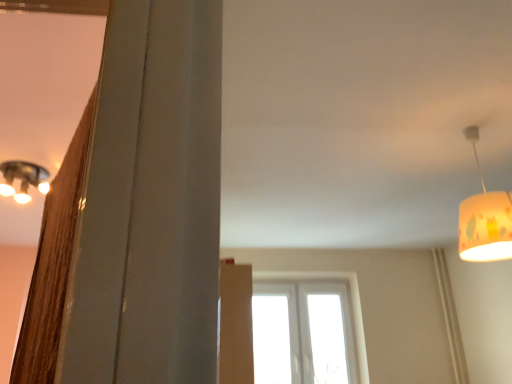
Question: Is transparent glass window at center in front of or behind yellow fabric lampshade at upper right in the image?

Choices:
 (A) front
 (B) behind

Answer: (B)

Question: From the image's perspective, is transparent glass window at center positioned above or below yellow fabric lampshade at upper right?

Choices:
 (A) above
 (B) below

Answer: (B)

Question: Does point (354, 337) appear closer or farther from the camera than point (509, 205)?

Choices:
 (A) closer
 (B) farther

Answer: (B)

Question: From the image's perspective, is yellow fabric lampshade at upper right above or below transparent glass window at center?

Choices:
 (A) below
 (B) above

Answer: (B)

Question: Is yellow fabric lampshade at upper right wider or thinner than transparent glass window at center?

Choices:
 (A) thin
 (B) wide

Answer: (B)

Question: Based on their positions, is yellow fabric lampshade at upper right located to the left or right of transparent glass window at center?

Choices:
 (A) left
 (B) right

Answer: (B)

Question: Is point (478, 226) closer or farther from the camera than point (317, 274)?

Choices:
 (A) farther
 (B) closer

Answer: (B)